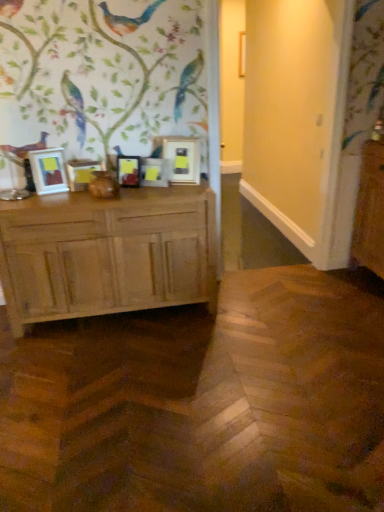
What do you see at coordinates (49, 170) in the screenshot?
I see `matte wooden picture frame at left, which is the 5th picture frame from right to left` at bounding box center [49, 170].

In order to click on matte wooden picture frame at center, which is the 4th picture frame from left to right in this screenshot , I will do `click(154, 172)`.

What do you see at coordinates (179, 157) in the screenshot? I see `matte gold picture frame at center, which is the first picture frame from right to left` at bounding box center [179, 157].

Locate an element on the screen. light brown wood chest of drawers at left is located at coordinates (107, 253).

Locate an element on the screen. The height and width of the screenshot is (512, 384). matte wooden picture frame at left, marked as the 1th picture frame in a left-to-right arrangement is located at coordinates (49, 170).

Is matte wooden picture frame at left, placed as the second picture frame when sorted from left to right, thinner than matte gold picture frame at center, the fifth picture frame from the left?

Indeed, matte wooden picture frame at left, placed as the second picture frame when sorted from left to right, has a lesser width compared to matte gold picture frame at center, the fifth picture frame from the left.

Is matte wooden picture frame at left, the fourth picture frame from the right, turned away from matte gold picture frame at center, the fifth picture frame from the left?

matte wooden picture frame at left, the fourth picture frame from the right, does not have its back to matte gold picture frame at center, the fifth picture frame from the left.

Relative to matte gold picture frame at center, the fifth picture frame from the left, is matte wooden picture frame at left, the fourth picture frame from the right, in front or behind?

Clearly, matte wooden picture frame at left, the fourth picture frame from the right, is in front of matte gold picture frame at center, the fifth picture frame from the left.

Is matte wooden picture frame at center, which is counted as the 2th picture frame, starting from the right, taller than matte gold picture frame at center, which is the first picture frame from right to left?

No.

Looking at this image, considering the relative positions of matte wooden picture frame at center, which is the 4th picture frame from left to right, and matte gold picture frame at center, which is the first picture frame from right to left, in the image provided, is matte wooden picture frame at center, which is the 4th picture frame from left to right, to the right of matte gold picture frame at center, which is the first picture frame from right to left, from the viewer's perspective?

No.

How distant is matte wooden picture frame at center, which is the 4th picture frame from left to right, from matte gold picture frame at center, which is the first picture frame from right to left?

matte wooden picture frame at center, which is the 4th picture frame from left to right, and matte gold picture frame at center, which is the first picture frame from right to left, are 4.45 inches apart from each other.

From a real-world perspective, count 4th picture frames downward from the matte gold picture frame at center, which is the first picture frame from right to left, and point to it. Please provide its 2D coordinates.

[(154, 172)]

From the image's perspective, is light brown wood chest of drawers at left over matte wooden picture frame at left, the fourth picture frame from the right?

No, from the image's perspective, light brown wood chest of drawers at left is not above matte wooden picture frame at left, the fourth picture frame from the right.

How far apart are light brown wood chest of drawers at left and matte wooden picture frame at left, placed as the second picture frame when sorted from left to right?

light brown wood chest of drawers at left and matte wooden picture frame at left, placed as the second picture frame when sorted from left to right, are 54.49 centimeters apart.

How different are the orientations of light brown wood chest of drawers at left and matte wooden picture frame at left, the fourth picture frame from the right, in degrees?

9.04 degrees separate the facing orientations of light brown wood chest of drawers at left and matte wooden picture frame at left, the fourth picture frame from the right.

Does light brown wood chest of drawers at left turn towards matte wooden picture frame at left, the fourth picture frame from the right?

No.

Is matte wooden picture frame at left, which is the 5th picture frame from right to left, inside matte black picture frame at center, which ranks as the third picture frame in left-to-right order?

No, matte wooden picture frame at left, which is the 5th picture frame from right to left, is not inside matte black picture frame at center, which ranks as the third picture frame in left-to-right order.

Is matte black picture frame at center, which is the 3th picture frame from right to left, touching matte wooden picture frame at left, which is the 5th picture frame from right to left?

No, matte black picture frame at center, which is the 3th picture frame from right to left, is not making contact with matte wooden picture frame at left, which is the 5th picture frame from right to left.

From the matte black picture frame at center, which ranks as the third picture frame in left-to-right order, count the 2nd picture frame to the left and point to it. Please provide its 2D coordinates.

[(49, 170)]

From a real-world perspective, relative to matte wooden picture frame at left, which is the 5th picture frame from right to left, is matte black picture frame at center, which is the 3th picture frame from right to left, vertically above or below?

From a real-world perspective, matte black picture frame at center, which is the 3th picture frame from right to left, is physically below matte wooden picture frame at left, which is the 5th picture frame from right to left.

Considering the relative sizes of light brown wood chest of drawers at left and matte black picture frame at center, which is the 3th picture frame from right to left, in the image provided, is light brown wood chest of drawers at left taller than matte black picture frame at center, which is the 3th picture frame from right to left,?

Indeed, light brown wood chest of drawers at left has a greater height compared to matte black picture frame at center, which is the 3th picture frame from right to left.

Is light brown wood chest of drawers at left placed right next to matte black picture frame at center, which is the 3th picture frame from right to left?

No, light brown wood chest of drawers at left is not with matte black picture frame at center, which is the 3th picture frame from right to left.

From the picture: Is light brown wood chest of drawers at left at the right side of matte black picture frame at center, which is the 3th picture frame from right to left?

No.

Does light brown wood chest of drawers at left have a larger size compared to matte black picture frame at center, which is the 3th picture frame from right to left?

Yes, light brown wood chest of drawers at left is bigger than matte black picture frame at center, which is the 3th picture frame from right to left.

From the picture: From the image's perspective, who appears lower, matte wooden picture frame at center, which is counted as the 2th picture frame, starting from the right, or matte black picture frame at center, which is the 3th picture frame from right to left?

From the image's view, matte black picture frame at center, which is the 3th picture frame from right to left, is below.

Can you tell me how much matte wooden picture frame at center, which is counted as the 2th picture frame, starting from the right, and matte black picture frame at center, which is the 3th picture frame from right to left, differ in facing direction?

There is a 1.14-degree angle between the facing directions of matte wooden picture frame at center, which is counted as the 2th picture frame, starting from the right, and matte black picture frame at center, which is the 3th picture frame from right to left.

Is point (162, 183) more distant than point (122, 169)?

Yes, it is.

Considering their positions, is matte wooden picture frame at center, which is the 4th picture frame from left to right, located in front of or behind matte black picture frame at center, which ranks as the third picture frame in left-to-right order?

matte wooden picture frame at center, which is the 4th picture frame from left to right, is behind matte black picture frame at center, which ranks as the third picture frame in left-to-right order.

Which object is thinner, light brown wood chest of drawers at left or matte gold picture frame at center, which is the first picture frame from right to left?

matte gold picture frame at center, which is the first picture frame from right to left, is thinner.

Can you tell me how much light brown wood chest of drawers at left and matte gold picture frame at center, the fifth picture frame from the left, differ in facing direction?

22.4 degrees separate the facing orientations of light brown wood chest of drawers at left and matte gold picture frame at center, the fifth picture frame from the left.

From a real-world perspective, is light brown wood chest of drawers at left below matte gold picture frame at center, which is the first picture frame from right to left?

Correct, in the physical world, light brown wood chest of drawers at left is lower than matte gold picture frame at center, which is the first picture frame from right to left.

Does point (48, 288) appear closer or farther from the camera than point (176, 137)?

Point (48, 288) appears to be closer to the viewer than point (176, 137).

This screenshot has width=384, height=512. I want to click on the 1st picture frame behind the matte wooden picture frame at left, the fourth picture frame from the right, so click(x=179, y=157).

From a real-world perspective, count 4th picture frames upward from the matte wooden picture frame at center, which is the 4th picture frame from left to right, and point to it. Please provide its 2D coordinates.

[(179, 157)]

Estimate the real-world distances between objects in this image. Which object is closer to matte wooden picture frame at center, which is the 4th picture frame from left to right, matte wooden picture frame at left, marked as the 1th picture frame in a left-to-right arrangement, or matte wooden picture frame at left, placed as the second picture frame when sorted from left to right?

Based on the image, matte wooden picture frame at left, placed as the second picture frame when sorted from left to right, appears to be nearer to matte wooden picture frame at center, which is the 4th picture frame from left to right.

Estimate the real-world distances between objects in this image. Which object is further from light brown wood chest of drawers at left, matte gold picture frame at center, the fifth picture frame from the left, or matte wooden picture frame at left, the fourth picture frame from the right?

Based on the image, matte gold picture frame at center, the fifth picture frame from the left, appears to be further to light brown wood chest of drawers at left.

When comparing their distances from matte wooden picture frame at left, placed as the second picture frame when sorted from left to right, does matte black picture frame at center, which is the 3th picture frame from right to left, or matte wooden picture frame at center, which is the 4th picture frame from left to right, seem further?

The object further to matte wooden picture frame at left, placed as the second picture frame when sorted from left to right, is matte wooden picture frame at center, which is the 4th picture frame from left to right.

When comparing their distances from light brown wood chest of drawers at left, does matte wooden picture frame at left, which is the 5th picture frame from right to left, or matte gold picture frame at center, which is the first picture frame from right to left, seem further?

Based on the image, matte gold picture frame at center, which is the first picture frame from right to left, appears to be further to light brown wood chest of drawers at left.

From the image, which object appears to be farther from matte wooden picture frame at left, marked as the 1th picture frame in a left-to-right arrangement, matte gold picture frame at center, which is the first picture frame from right to left, or matte wooden picture frame at center, which is the 4th picture frame from left to right?

matte gold picture frame at center, which is the first picture frame from right to left.

Looking at the image, which one is located closer to matte gold picture frame at center, which is the first picture frame from right to left, matte wooden picture frame at center, which is the 4th picture frame from left to right, or matte black picture frame at center, which is the 3th picture frame from right to left?

matte wooden picture frame at center, which is the 4th picture frame from left to right.

From the image, which object appears to be nearer to matte black picture frame at center, which ranks as the third picture frame in left-to-right order, light brown wood chest of drawers at left or matte gold picture frame at center, which is the first picture frame from right to left?

matte gold picture frame at center, which is the first picture frame from right to left, is positioned closer to the anchor matte black picture frame at center, which ranks as the third picture frame in left-to-right order.

Based on their spatial positions, is matte wooden picture frame at left, marked as the 1th picture frame in a left-to-right arrangement, or matte black picture frame at center, which is the 3th picture frame from right to left, closer to matte wooden picture frame at center, which is the 4th picture frame from left to right?

matte black picture frame at center, which is the 3th picture frame from right to left, is positioned closer to the anchor matte wooden picture frame at center, which is the 4th picture frame from left to right.

Locate an element on the screen. The height and width of the screenshot is (512, 384). picture frame between matte wooden picture frame at left, marked as the 1th picture frame in a left-to-right arrangement, and matte black picture frame at center, which is the 3th picture frame from right to left, in the horizontal direction is located at coordinates (81, 173).

Identify the location of chest of drawers between matte wooden picture frame at left, marked as the 1th picture frame in a left-to-right arrangement, and matte gold picture frame at center, the fifth picture frame from the left. (107, 253).

You are a GUI agent. You are given a task and a screenshot of the screen. Output one action in this format:
    pyautogui.click(x=<x>, y=<y>)
    Task: Click on the picture frame between matte wooden picture frame at left, placed as the second picture frame when sorted from left to right, and matte wooden picture frame at center, which is counted as the 2th picture frame, starting from the right
    
    Given the screenshot: What is the action you would take?
    pyautogui.click(x=128, y=170)

The image size is (384, 512). I want to click on picture frame between matte wooden picture frame at left, marked as the 1th picture frame in a left-to-right arrangement, and light brown wood chest of drawers at left in the up-down direction, so click(81, 173).